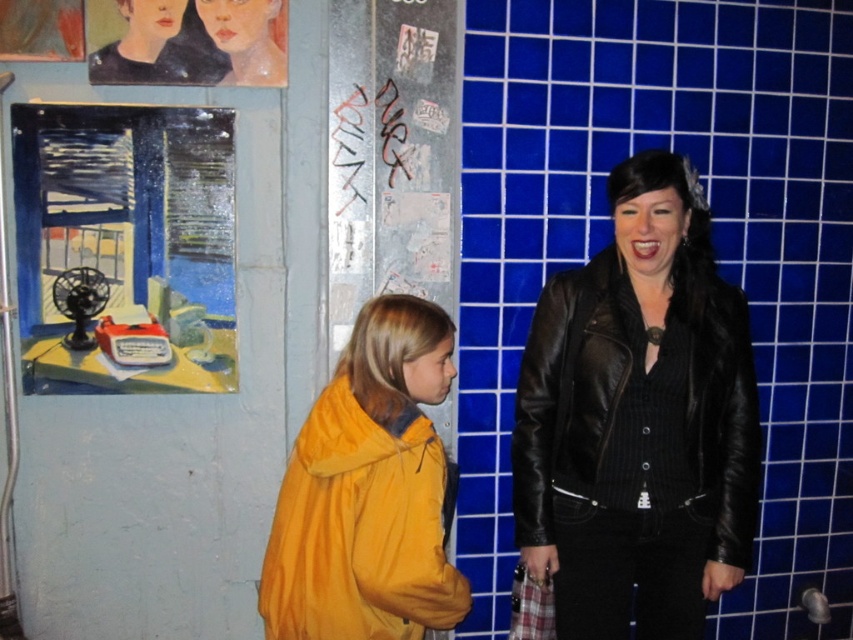
You are a photographer trying to capture the perfect shot of the yellow matte jacket at center. You need to position your camera at point A, which is directly to the left of the jacket. Where should you place your camera relative to the jacket?

The yellow matte jacket at center is located at point (x=368, y=492). To position the camera directly to the left of it, you should place it at a point with a lower x coordinate than 0.769 while maintaining the same y coordinate of 0.433.

You are a tailor measuring jackets for customers. You have a customer who wants to wear a jacket that is not too bulky. Which jacket between the yellow matte jacket at center and the black leather jacket at right would you recommend?

The yellow matte jacket at center is thinner than the black leather jacket at right, so it would be less bulky and more comfortable for the customer.